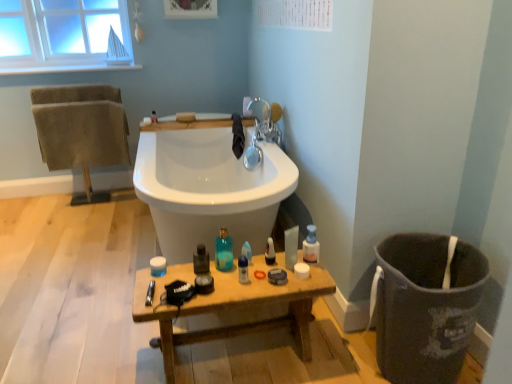
Identify the location of unoccupied area in front of translucent blue glass bottle at center, the 2th toiletry in the bottom-to-top sequence. (230, 281).